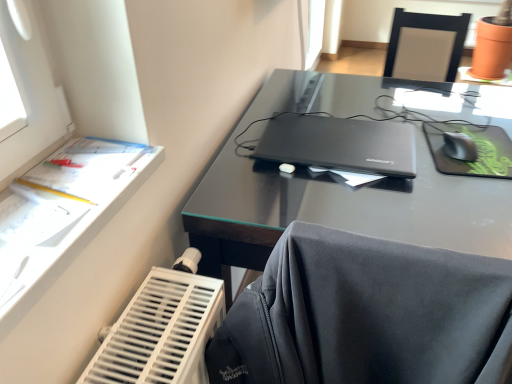
The image size is (512, 384). I want to click on unoccupied space behind matte black laptop at center, so click(x=332, y=100).